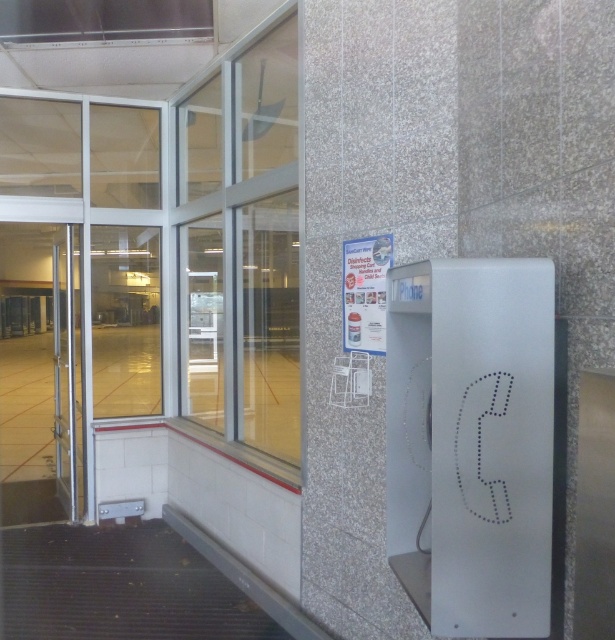
Between white plastic phone at right and clear glass door at left, which one appears on the left side from the viewer's perspective?

clear glass door at left

In the scene shown: Does white plastic phone at right have a lesser height compared to clear glass door at left?

Correct, white plastic phone at right is not as tall as clear glass door at left.

Between point (493, 358) and point (39, 378), which one is positioned in front?

Point (493, 358)

Find the location of a particular element. Image resolution: width=615 pixels, height=640 pixels. white plastic phone at right is located at coordinates (470, 442).